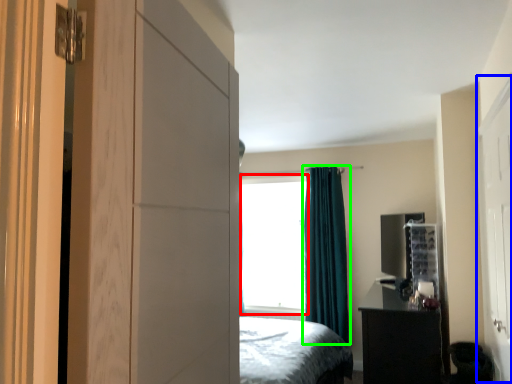
Question: Based on their relative distances, which object is farther from window screen (highlighted by a red box)? Choose from screen door (highlighted by a blue box) and curtain (highlighted by a green box).

Choices:
 (A) screen door
 (B) curtain

Answer: (A)